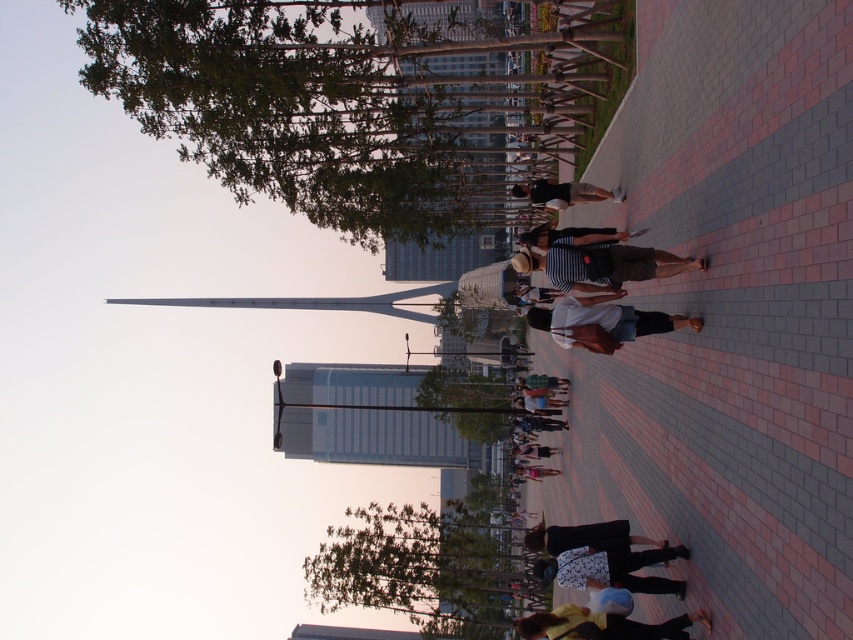
Question: Is striped cotton shirt at center bigger than denim shorts at center?

Choices:
 (A) yes
 (B) no

Answer: (B)

Question: Which of the following is the closest to the observer?

Choices:
 (A) denim shorts at center
 (B) yellow fabric bag at lower center

Answer: (B)

Question: Which of the following is the closest to the observer?

Choices:
 (A) (517, 186)
 (B) (595, 276)
 (C) (541, 330)
 (D) (601, 618)

Answer: (D)

Question: Can you confirm if striped cotton shirt at center is thinner than matte black shirt at center?

Choices:
 (A) yes
 (B) no

Answer: (A)

Question: Is the position of striped cotton shirt at center less distant than that of denim shorts at center?

Choices:
 (A) no
 (B) yes

Answer: (B)

Question: Which point is farther from the camera taking this photo?

Choices:
 (A) (534, 195)
 (B) (634, 323)
 (C) (560, 628)

Answer: (A)